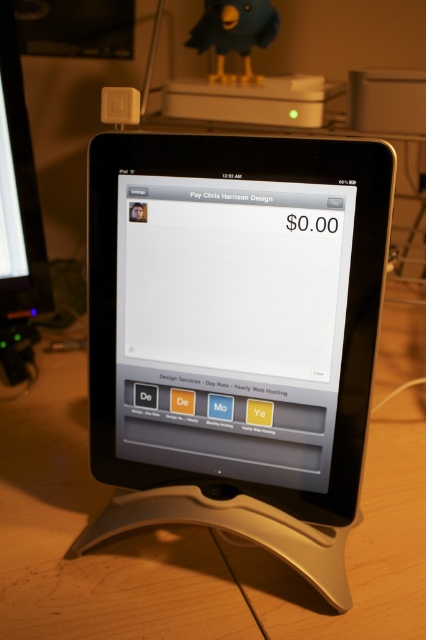
Does black matte tablet at center have a smaller size compared to matte black tablet at center?

No, black matte tablet at center is not smaller than matte black tablet at center.

Is point (337, 266) positioned in front of point (184, 429)?

Yes, point (337, 266) is closer to viewer.

The image size is (426, 640). Describe the element at coordinates (236, 336) in the screenshot. I see `black matte tablet at center` at that location.

Find the location of a particular element. The image size is (426, 640). black matte tablet at center is located at coordinates (236, 336).